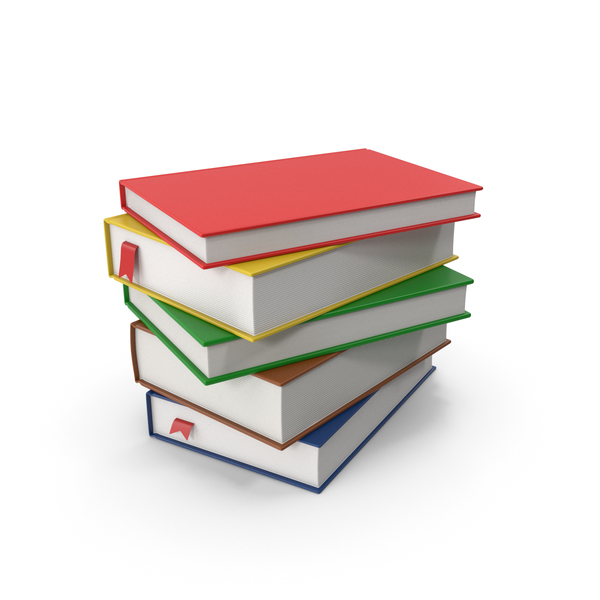
At what (x,y) coordinates should I click in order to perform the action: click on stack of books. Please return your answer as a coordinate pair (x, y). The width and height of the screenshot is (600, 600). Looking at the image, I should click on click(298, 336).